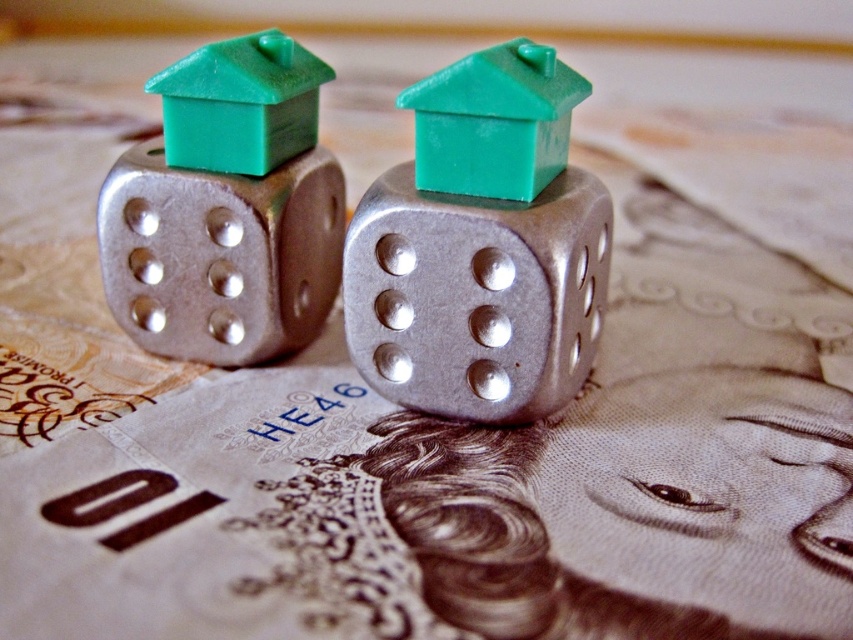
Question: Among these points, which one is farthest from the camera?

Choices:
 (A) (59, 518)
 (B) (527, 180)
 (C) (508, 355)
 (D) (228, 109)

Answer: (D)

Question: Can you confirm if metallic silver dice at left is positioned to the right of green plastic house at center?

Choices:
 (A) no
 (B) yes

Answer: (A)

Question: Among these objects, which one is nearest to the camera?

Choices:
 (A) green plastic house at center
 (B) black paper at lower left

Answer: (B)

Question: Is metallic silver dice at left below green plastic house at center?

Choices:
 (A) yes
 (B) no

Answer: (A)

Question: Can you confirm if green plastic house at center is smaller than black paper at lower left?

Choices:
 (A) no
 (B) yes

Answer: (A)

Question: Estimate the real-world distances between objects in this image. Which object is closer to the brushed metal dice at center?

Choices:
 (A) metallic silver dice at left
 (B) green matte house at upper center
 (C) green plastic house at center
 (D) black paper at lower left

Answer: (C)